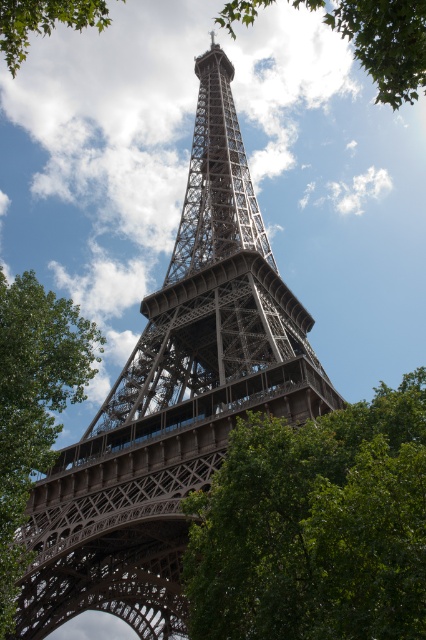
Question: Among these points, which one is nearest to the camera?

Choices:
 (A) (374, 433)
 (B) (405, 96)

Answer: (B)

Question: Does green leafy tree at lower center lie in front of green leafy tree at left?

Choices:
 (A) no
 (B) yes

Answer: (B)

Question: Is green leafy tree at lower center above green leafy tree at upper center?

Choices:
 (A) yes
 (B) no

Answer: (B)

Question: Which of these objects is positioned farthest from the green leafy tree at upper left?

Choices:
 (A) green leafy tree at left
 (B) green leafy tree at lower center
 (C) green leafy tree at upper center

Answer: (B)

Question: Considering the real-world distances, which object is farthest from the green leafy tree at upper left?

Choices:
 (A) green leafy tree at upper center
 (B) green leafy tree at lower center
 (C) green leafy tree at left

Answer: (B)

Question: Observing the image, what is the correct spatial positioning of green leafy tree at lower center in reference to green leafy tree at upper left?

Choices:
 (A) below
 (B) above

Answer: (A)